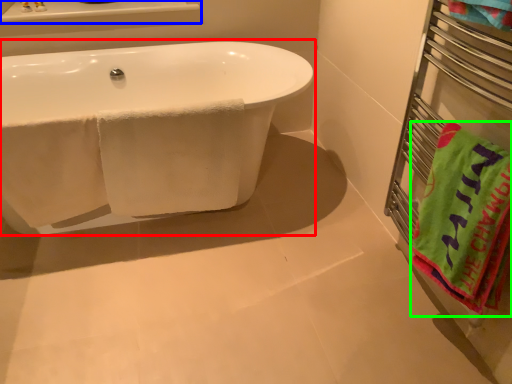
Question: Which object is positioned closest to bathtub (highlighted by a red box)? Select from window sill (highlighted by a blue box) and beach towel (highlighted by a green box).

Choices:
 (A) window sill
 (B) beach towel

Answer: (A)